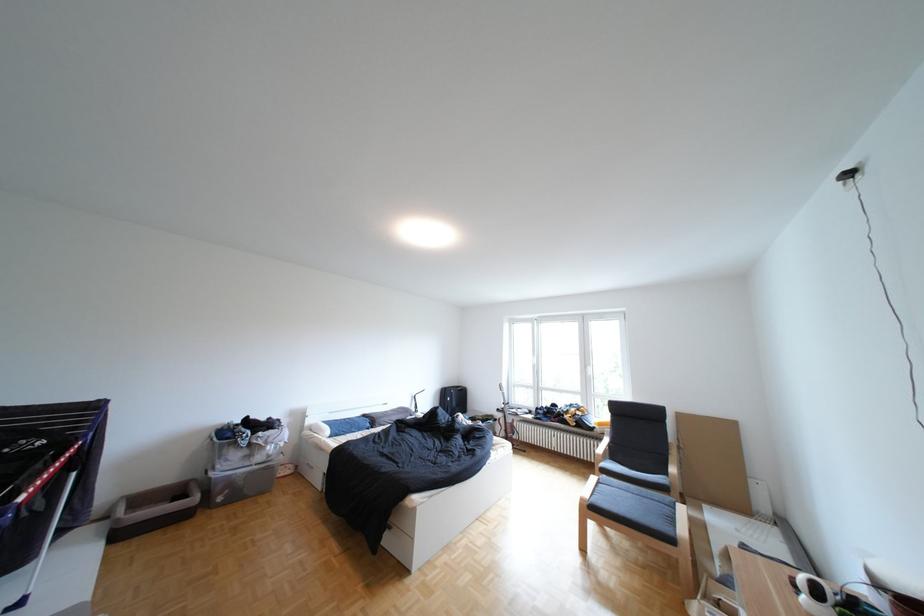
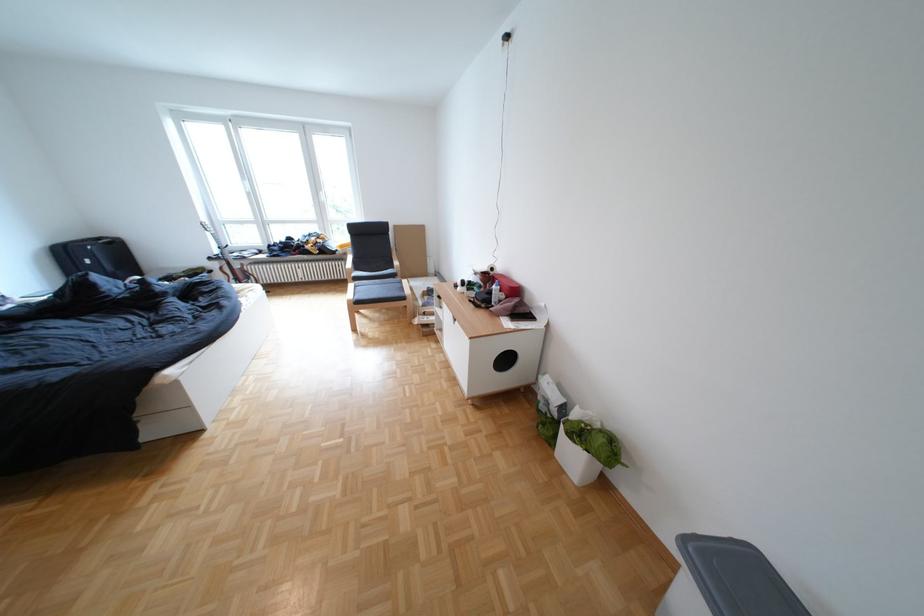
Find the pixel in the second image that matches pixel 514 411 in the first image.

(225, 259)